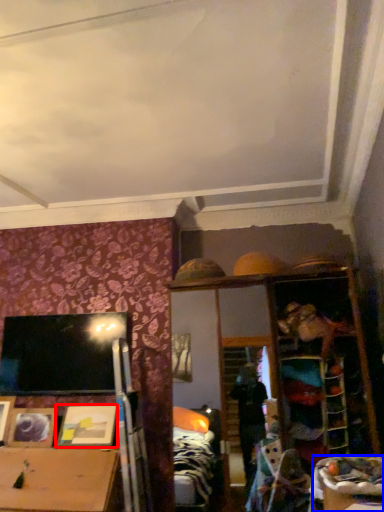
Question: Which of the following is the closest to the observer, picture frame (highlighted by a red box) or table (highlighted by a blue box)?

Choices:
 (A) picture frame
 (B) table

Answer: (B)